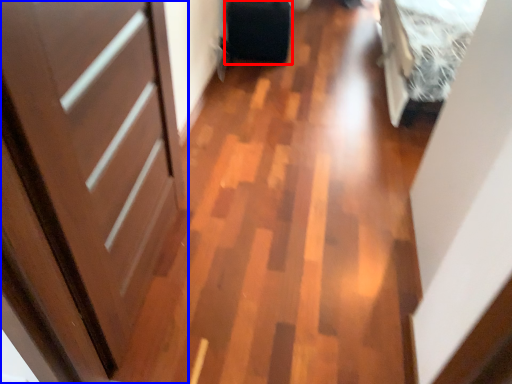
Question: Which object appears closest to the camera in this image, luggage (highlighted by a red box) or door (highlighted by a blue box)?

Choices:
 (A) luggage
 (B) door

Answer: (B)